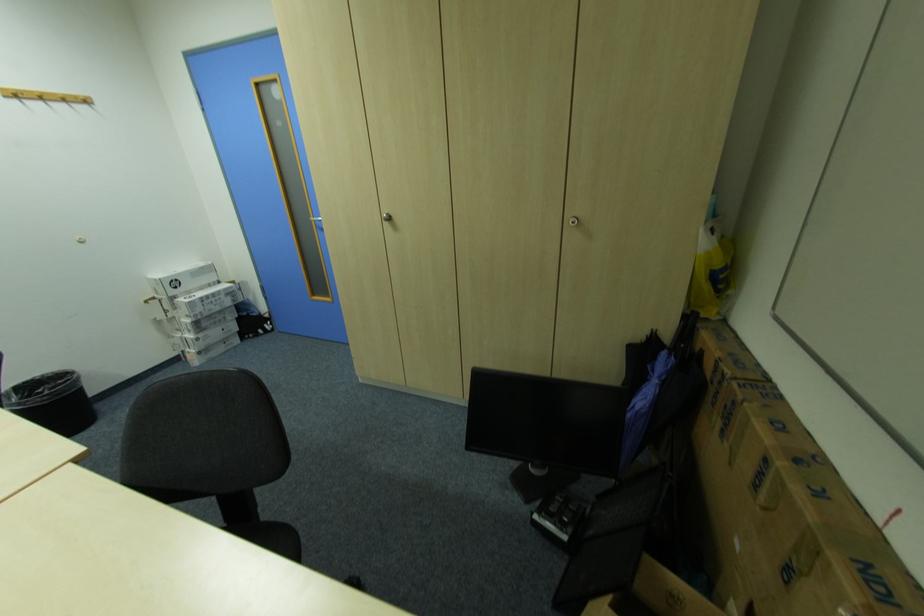
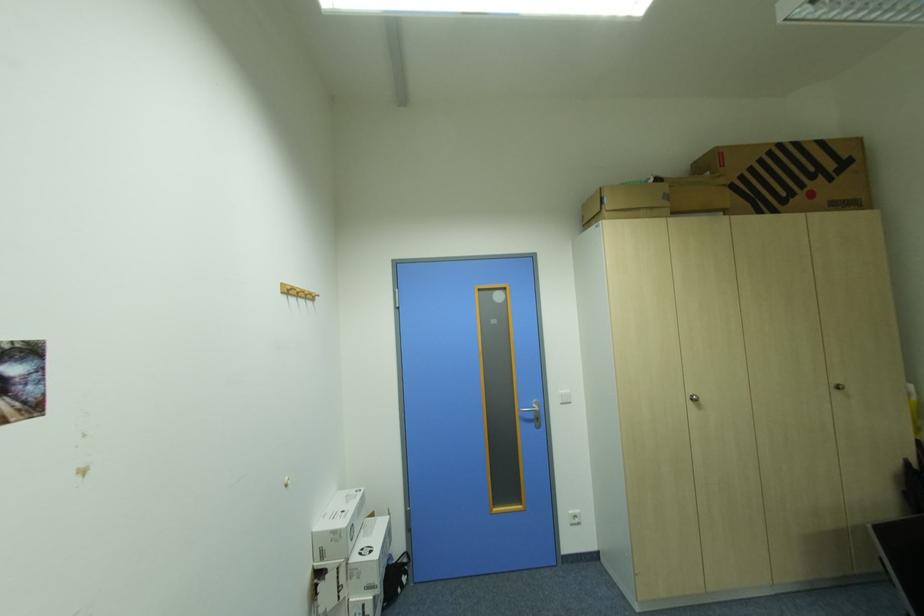
Where in the second image is the point corresponding to the point at 196,317 from the first image?

(377, 590)